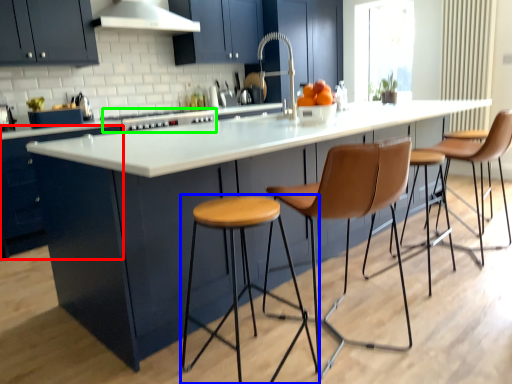
Question: Based on their relative distances, which object is nearer to cabinetry (highlighted by a red box)? Choose from stool (highlighted by a blue box) and stove (highlighted by a green box).

Choices:
 (A) stool
 (B) stove

Answer: (B)